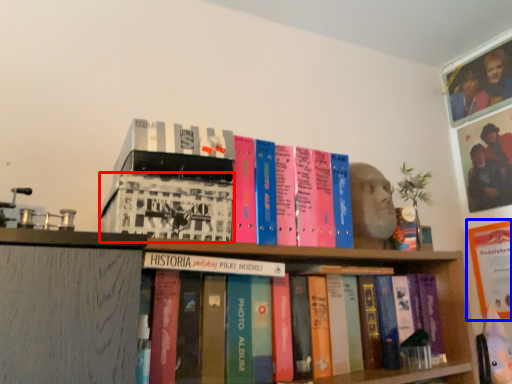
Question: Which object appears farthest to the camera in this image, book (highlighted by a red box) or paperback book (highlighted by a blue box)?

Choices:
 (A) book
 (B) paperback book

Answer: (B)